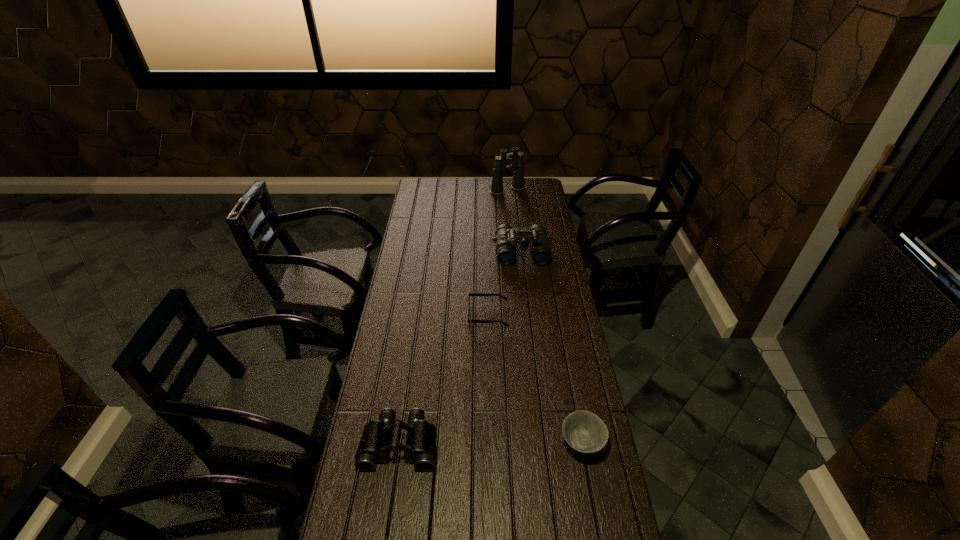
Where is `the farthest object`? Image resolution: width=960 pixels, height=540 pixels. the farthest object is located at coordinates (516, 158).

This screenshot has height=540, width=960. In order to click on the tallest binoculars in this screenshot , I will do `click(516, 158)`.

This screenshot has height=540, width=960. Identify the location of the fourth nearest object. (506, 238).

Identify the location of the second tallest object. (506, 238).

Locate an element on the screen. the leftmost binoculars is located at coordinates [374, 446].

This screenshot has height=540, width=960. Find the location of `the nearest binoculars`. the nearest binoculars is located at coordinates (374, 446).

The image size is (960, 540). Find the location of `the second shortest object`. the second shortest object is located at coordinates (584, 431).

The image size is (960, 540). I want to click on spectacles, so click(470, 294).

Locate an element on the screen. This screenshot has width=960, height=540. the shortest object is located at coordinates (470, 294).

Identify the location of free region located on the right of the farthest binoculars. (540, 190).